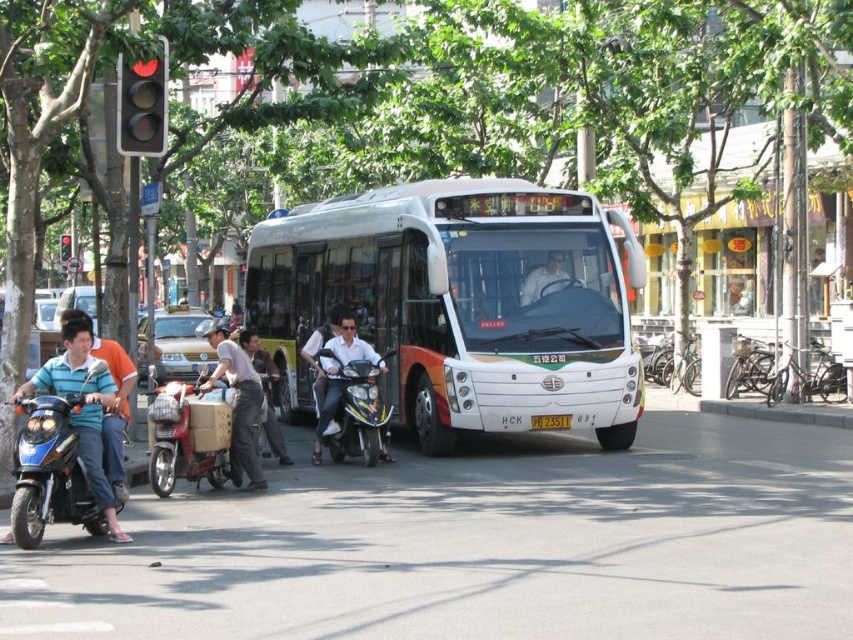
Question: Among these points, which one is nearest to the camera?

Choices:
 (A) (67, 234)
 (B) (363, 385)

Answer: (B)

Question: Which object is positioned closest to the black plastic traffic light at upper left?

Choices:
 (A) red glass traffic light at upper left
 (B) shiny black scooter at center
 (C) metallic red motorcycle at center-left
 (D) blue denim jeans at left

Answer: (A)

Question: Can you confirm if shiny blue motorcycle at left is positioned above light brown fabric shirt at center?

Choices:
 (A) no
 (B) yes

Answer: (A)

Question: Is light brown fabric shirt at center smaller than black plastic traffic light at upper left?

Choices:
 (A) no
 (B) yes

Answer: (A)

Question: Among these points, which one is nearest to the camera?

Choices:
 (A) (567, 282)
 (B) (74, 474)

Answer: (B)

Question: Can you confirm if shiny blue motorcycle at left is smaller than matte white bus at center?

Choices:
 (A) yes
 (B) no

Answer: (B)